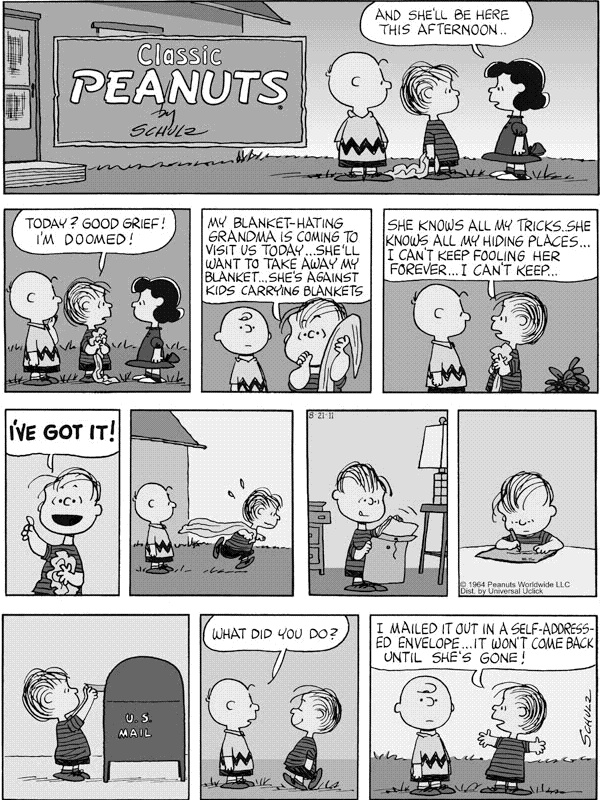
I want to click on linus' blanket, so click(406, 173), click(95, 338), click(350, 326), click(68, 562), click(220, 526), click(397, 526).